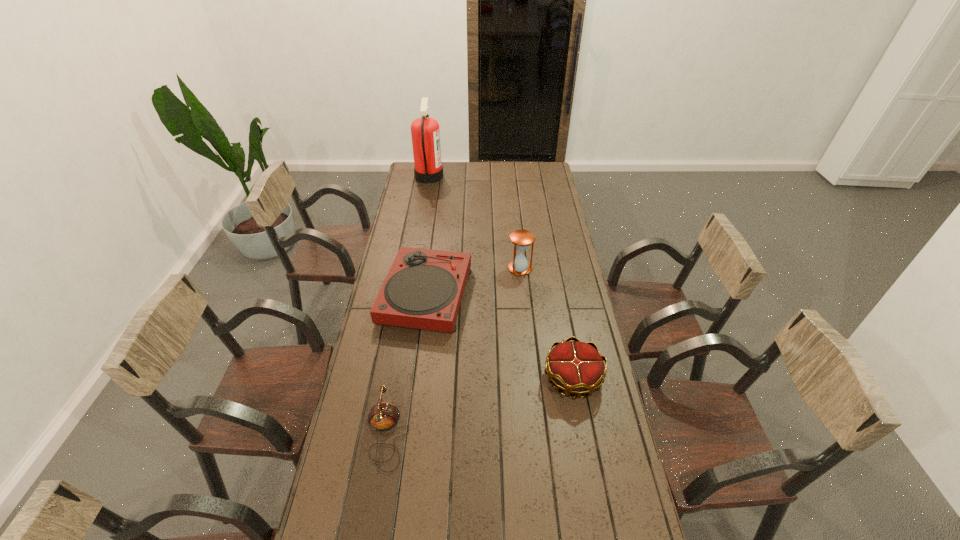
Identify which object is the second closest to the crown. Please provide its 2D coordinates. Your answer should be formatted as a tuple, i.e. [(x, y)], where the tuple contains the x and y coordinates of a point satisfying the conditions above.

[(521, 239)]

Identify which object is the third nearest to the tallest object. Please provide its 2D coordinates. Your answer should be formatted as a tuple, i.e. [(x, y)], where the tuple contains the x and y coordinates of a point satisfying the conditions above.

[(576, 367)]

Identify the location of vacant position in the image that satisfies the following two spatial constraints: 1. on the front side of the crown; 2. on the left side of the record player. (415, 379).

Locate an element on the screen. The width and height of the screenshot is (960, 540). free location that satisfies the following two spatial constraints: 1. on the front side of the crown; 2. on the rotary dial of the telephone is located at coordinates (583, 434).

Where is `blank area in the image that satisfies the following two spatial constraints: 1. at the nozzle of the farthest object; 2. on the right side of the record player`? This screenshot has width=960, height=540. blank area in the image that satisfies the following two spatial constraints: 1. at the nozzle of the farthest object; 2. on the right side of the record player is located at coordinates (409, 295).